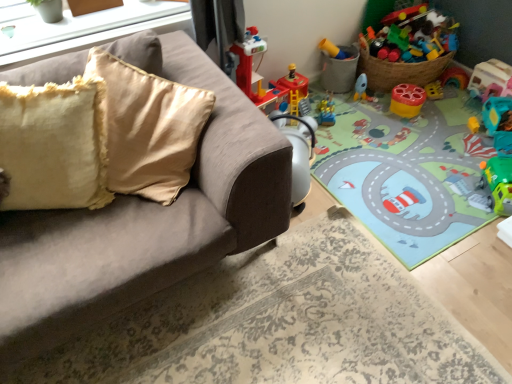
Find the location of a particular element. free space in front of yellow plastic cup at center-right, the 3th toy from the left is located at coordinates (416, 126).